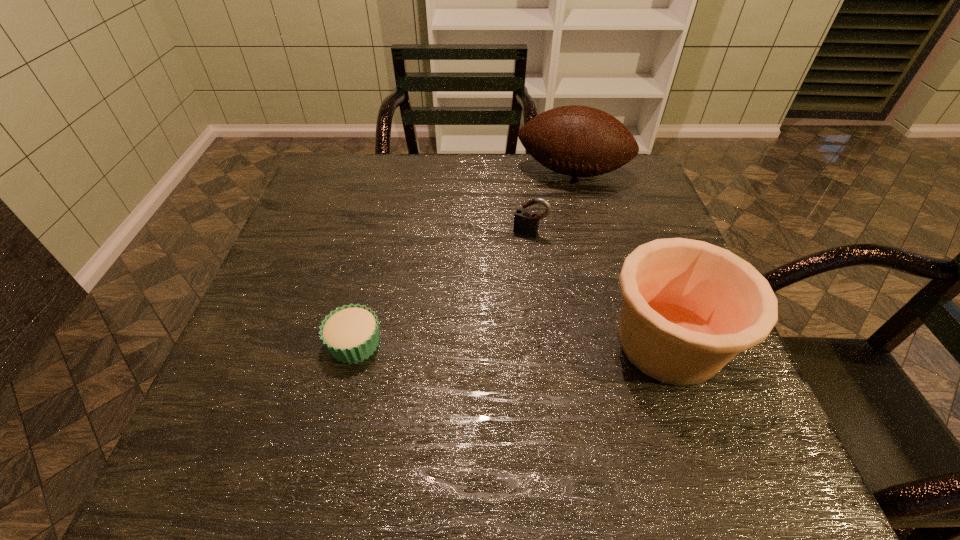
The width and height of the screenshot is (960, 540). Identify the location of vacant space on the desktop that is between the leftmost object and the pottery and is positioned with the keyhole on the front of the second farthest object. (478, 343).

Where is `free space on the desktop that is between the leftmost object and the pottery and is positioned on the laces of the football`? The height and width of the screenshot is (540, 960). free space on the desktop that is between the leftmost object and the pottery and is positioned on the laces of the football is located at coordinates (540, 343).